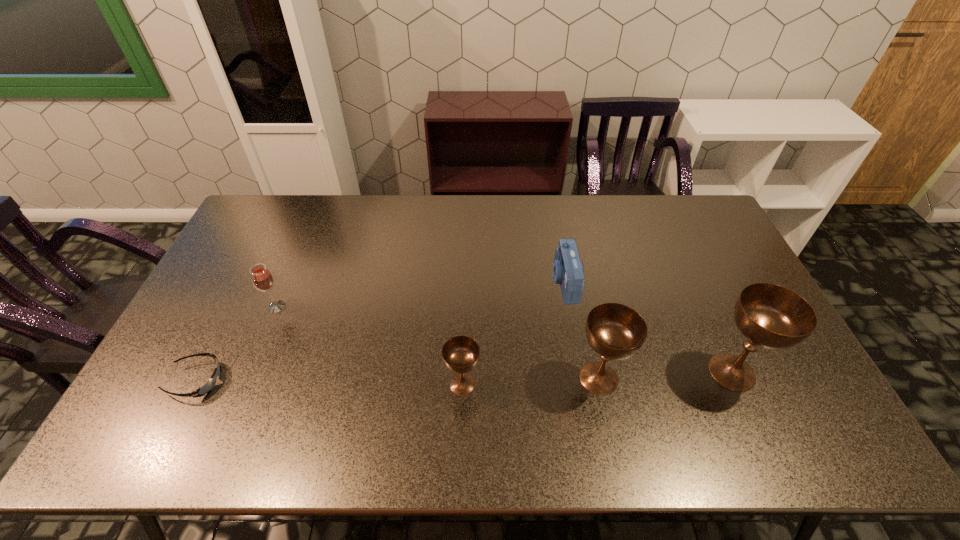
In order to click on free space in the image that satisfies the following two spatial constraints: 1. on the lenses of the shortest chalice; 2. on the left side of the sunglasses in this screenshot , I will do `click(194, 384)`.

Locate an element on the screen. Image resolution: width=960 pixels, height=540 pixels. free space that satisfies the following two spatial constraints: 1. on the lenses of the shortest chalice; 2. on the right side of the sunglasses is located at coordinates (194, 384).